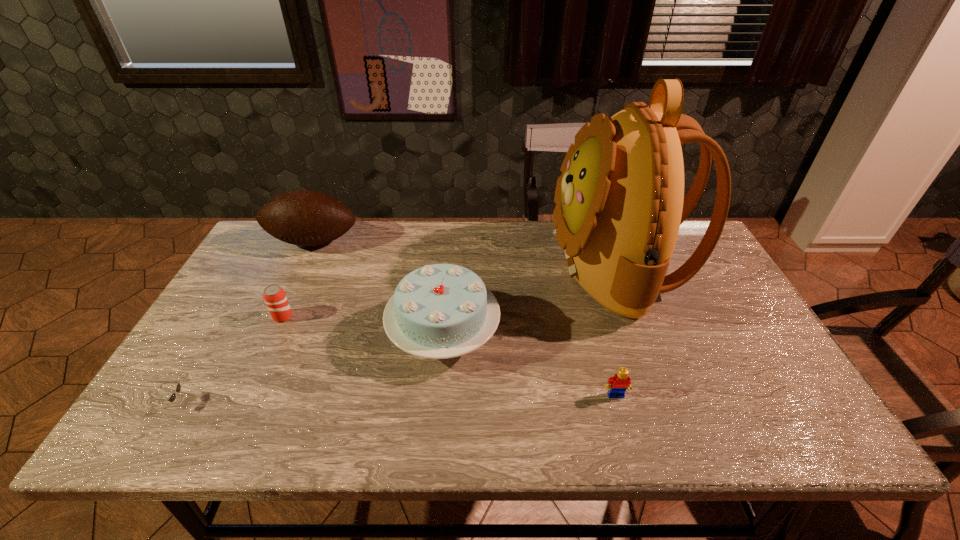
Identify the location of object positioned at the far left corner. The image size is (960, 540). (306, 218).

Identify the location of object situated at the near left corner. The height and width of the screenshot is (540, 960). (178, 388).

I want to click on object situated at the far right corner, so click(620, 202).

I want to click on vacant space at the far edge, so click(374, 237).

The width and height of the screenshot is (960, 540). Find the location of `free space at the near edge of the desktop`. free space at the near edge of the desktop is located at coordinates (284, 429).

Where is `free location at the right edge`? free location at the right edge is located at coordinates (766, 360).

Identify the location of vacant position at the far right corner of the desktop. The image size is (960, 540). (681, 242).

This screenshot has width=960, height=540. I want to click on free space between the fourth object from left to right and the football, so click(378, 287).

In order to click on unoccupied area between the tallest object and the Lego in this screenshot , I will do `click(616, 332)`.

I want to click on free area in between the Lego and the third object from right to left, so click(530, 364).